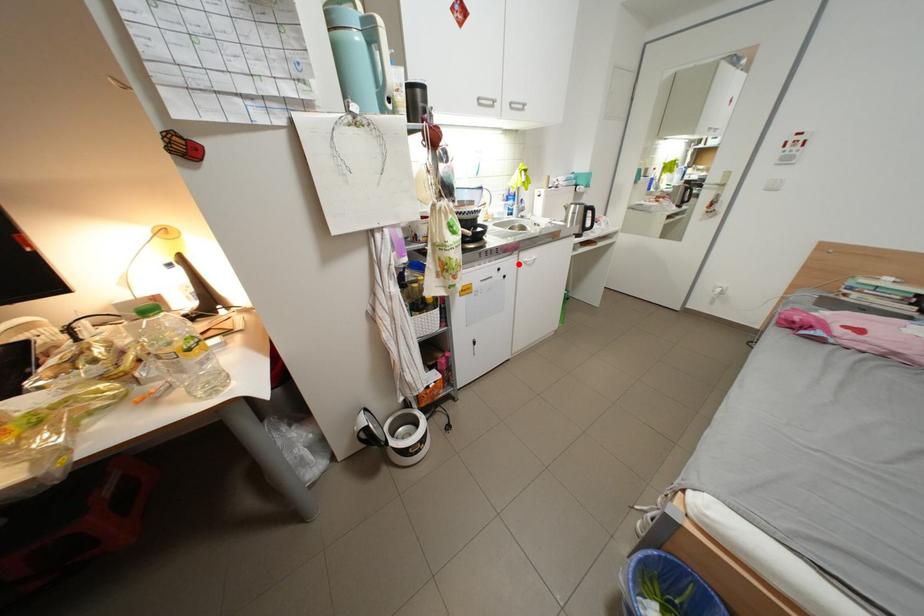
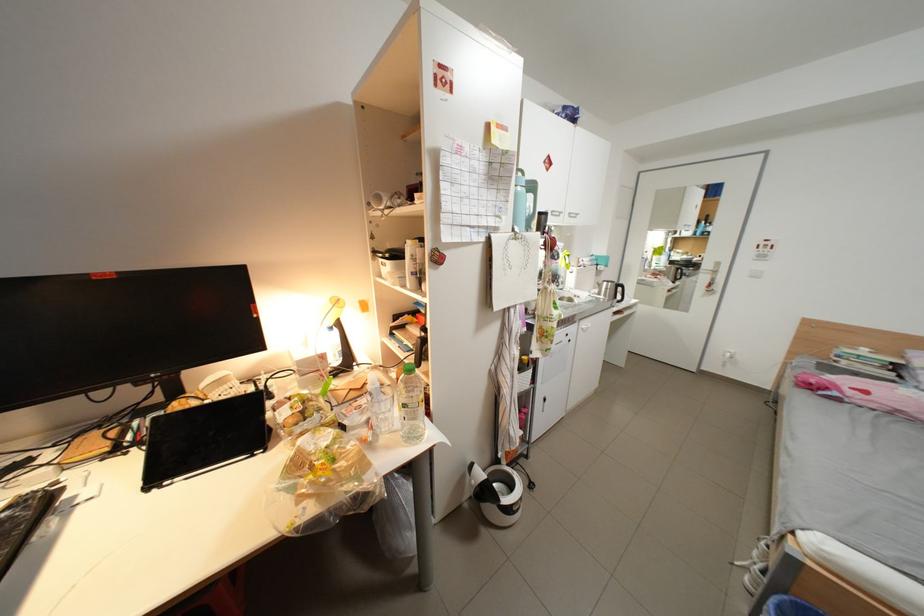
Find the pixel in the second image that matches the highlighted location in the first image.

(582, 331)